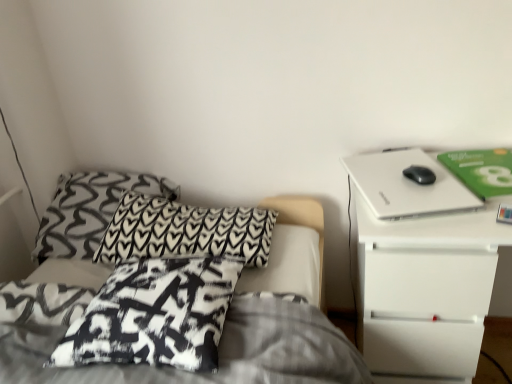
The width and height of the screenshot is (512, 384). I want to click on vacant area that is in front of black matte mouse at right, so click(x=429, y=195).